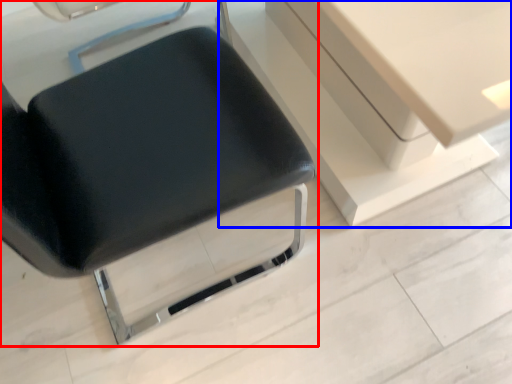
Question: Which point is closer to the camera, chair (highlighted by a red box) or vanity (highlighted by a blue box)?

Choices:
 (A) chair
 (B) vanity

Answer: (A)